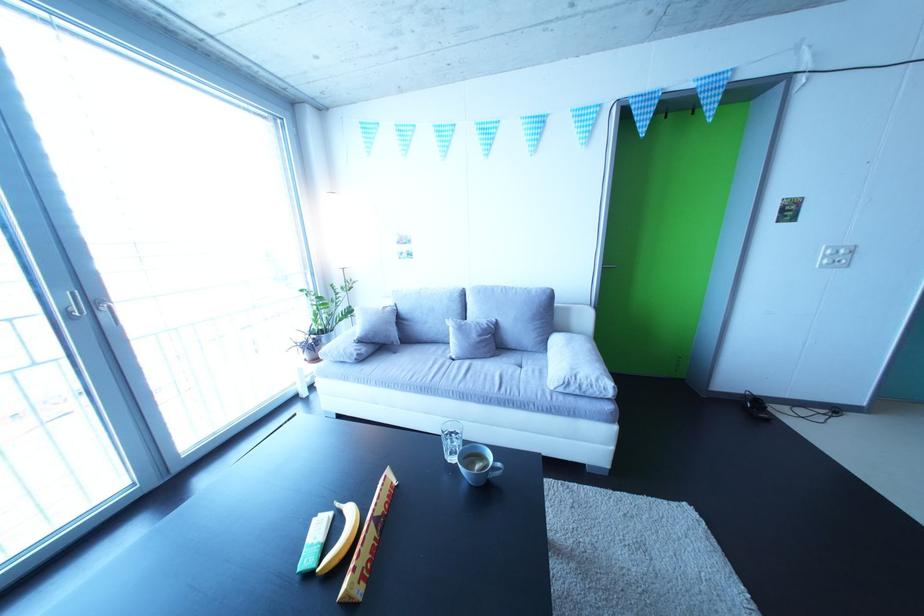
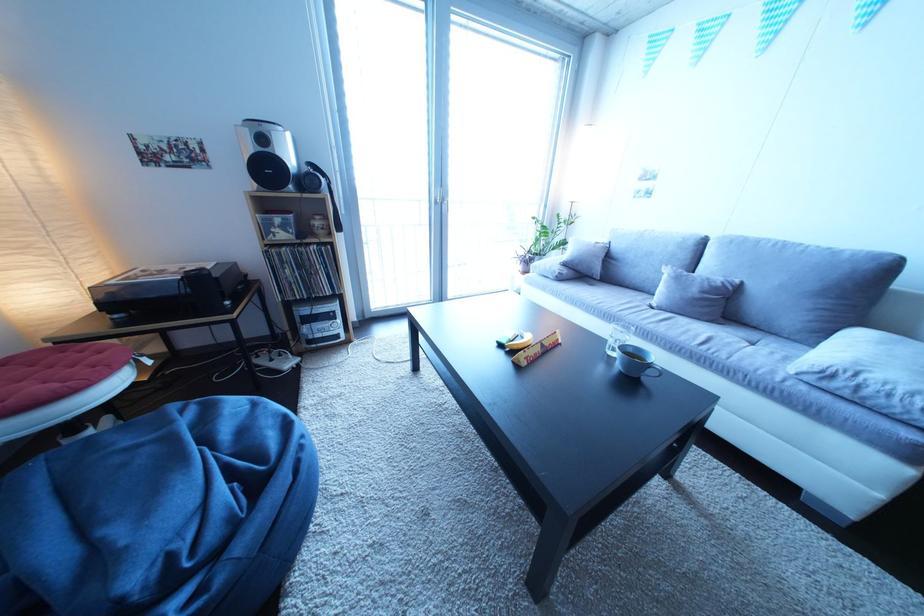
Find the pixel in the second image that matches point (506, 326) in the first image.

(750, 286)